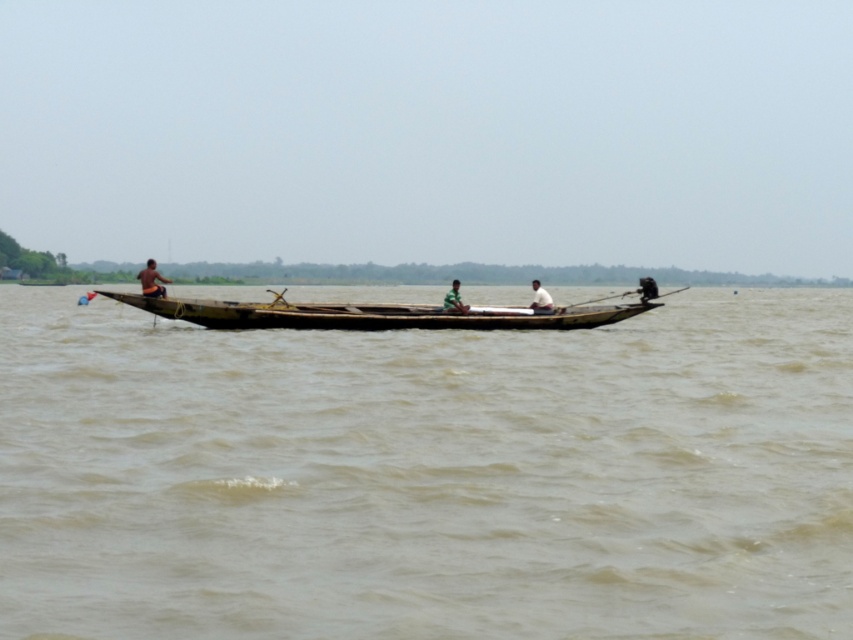
Question: Is rusty wood boat at center below green fabric person at center?

Choices:
 (A) no
 (B) yes

Answer: (B)

Question: Is the position of brown wooden boat at left less distant than that of green fabric person at center?

Choices:
 (A) no
 (B) yes

Answer: (A)

Question: Estimate the real-world distances between objects in this image. Which object is closer to the rusty wood boat at center?

Choices:
 (A) brown wooden boat at left
 (B) white fabric shirt at center
 (C) brown wooden boat at center

Answer: (B)

Question: Which is nearer to the brown wooden boat at center?

Choices:
 (A) green fabric person at center
 (B) white fabric shirt at center
 (C) rusty wood boat at center
 (D) brown wooden boat at left

Answer: (C)

Question: Can you confirm if rusty wood boat at center is positioned above green fabric person at center?

Choices:
 (A) no
 (B) yes

Answer: (A)

Question: Which of these objects is positioned farthest from the brown wooden boat at center?

Choices:
 (A) white fabric shirt at center
 (B) green fabric person at center
 (C) rusty wood boat at center
 (D) brown wooden boat at left

Answer: (A)